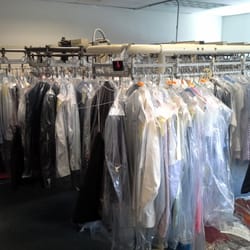
Identify the location of light reflecting on wall. (214, 21).